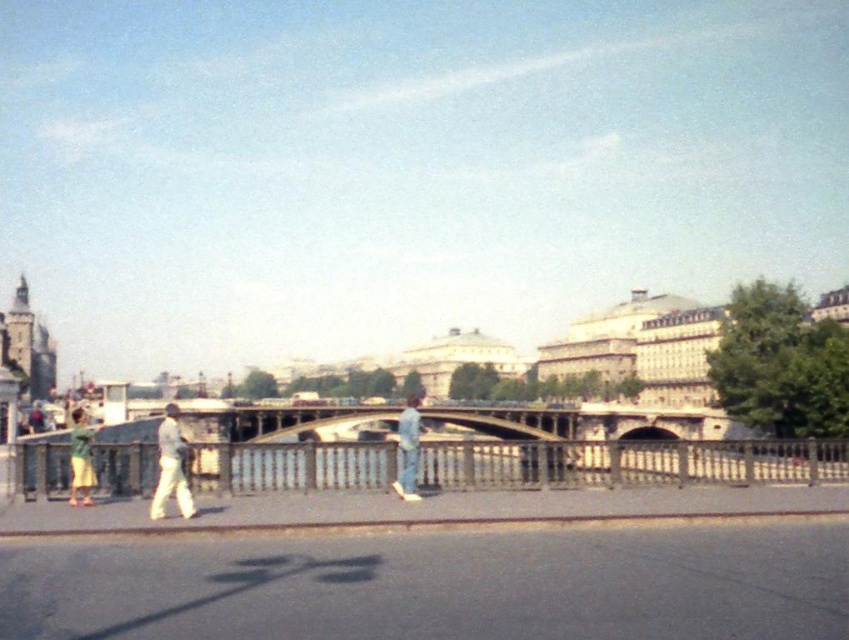
You are standing at point A located at coordinates point A at (411, 499). You want to walk to point B located at coordinates point B at 0.219, 0.515. The path between them is a straight line. If your walking speed is 1.5 meters per second, how long will it take you to reach point B?

The distance between point A at (411, 499) and point B at 0.219, 0.515 is 37.22 meters. At a speed of 1.5 meters per second, it will take approximately 24.81 seconds to reach point B.

You are standing at the bridge looking towards the city. There are two points marked on the bridge structure. The first point is at coordinates point (159, 449) and the second is at point (79, 406). Which point would appear larger in your view?

Point (159, 449) is closer to the camera than point (79, 406), so it would appear larger in your view.